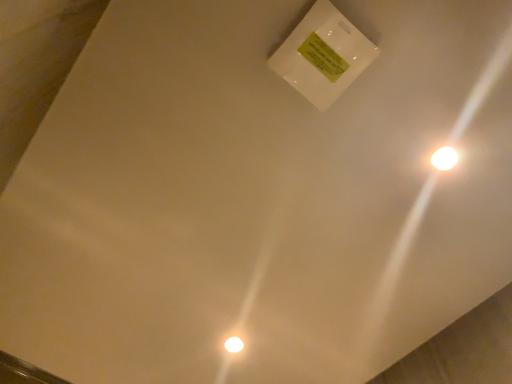
Question: Is white glossy light at upper right situated inside white glossy light bulb at lower center or outside?

Choices:
 (A) inside
 (B) outside

Answer: (B)

Question: From the image's perspective, is white glossy light at upper right positioned above or below white glossy light bulb at lower center?

Choices:
 (A) below
 (B) above

Answer: (B)

Question: In terms of height, does white glossy light at upper right look taller or shorter compared to white glossy light bulb at lower center?

Choices:
 (A) tall
 (B) short

Answer: (B)

Question: In the image, is white glossy light bulb at lower center on the left side or the right side of white glossy light at upper right?

Choices:
 (A) left
 (B) right

Answer: (A)

Question: From the image's perspective, relative to white glossy light at upper right, is white glossy light bulb at lower center above or below?

Choices:
 (A) below
 (B) above

Answer: (A)

Question: Looking at their shapes, would you say white glossy light bulb at lower center is wider or thinner than white glossy light at upper right?

Choices:
 (A) wide
 (B) thin

Answer: (A)

Question: In terms of height, does white glossy light bulb at lower center look taller or shorter compared to white glossy light at upper right?

Choices:
 (A) tall
 (B) short

Answer: (A)